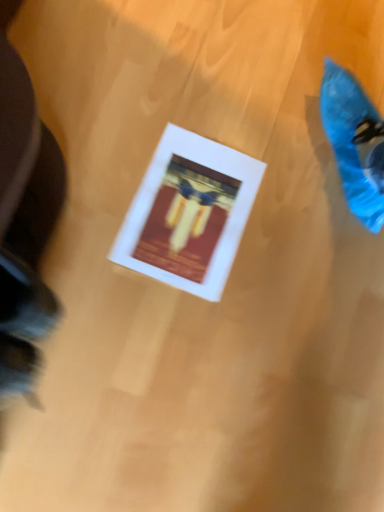
This screenshot has width=384, height=512. Find the location of `free space to the right of white matte picture frame at center`. free space to the right of white matte picture frame at center is located at coordinates (287, 279).